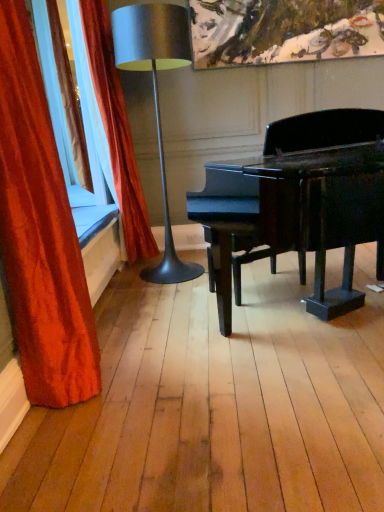
Locate an element on the screen. vacant space in front of metallic silver lamp at left is located at coordinates (176, 296).